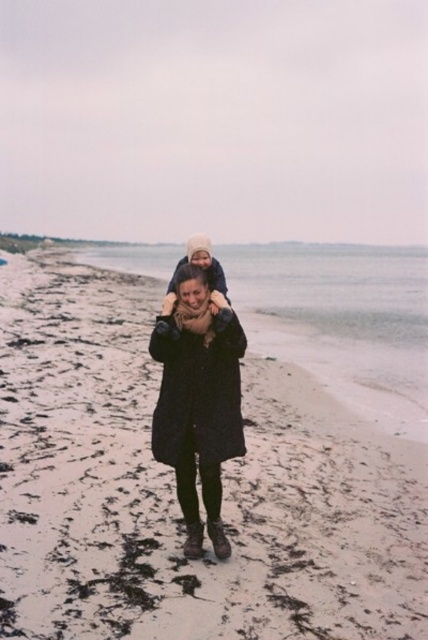
You are standing on the white sandy beach at center and want to walk to the matte black coat at center. In which direction should you walk?

You should walk to the right because the white sandy beach at center is positioned on the left side of the matte black coat at center.

You are standing on the white sandy beach at center and looking at the matte black coat at center. Which object is taller from your perspective?

The white sandy beach at center is much taller than the matte black coat at center.

Consider the image. You are standing at the edge of the beach and see two people in the distance. The first person is wearing a matte black coat at center. The second person is wearing a bright yellow rain jacket at lower right. How far apart are the two people?

The two people are 15.29 feet apart.